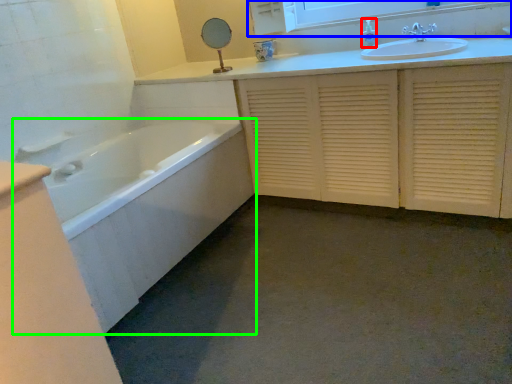
Question: Which is nearer to the toiletry (highlighted by a red box)? medicine cabinet (highlighted by a blue box) or bathtub (highlighted by a green box).

Choices:
 (A) medicine cabinet
 (B) bathtub

Answer: (A)